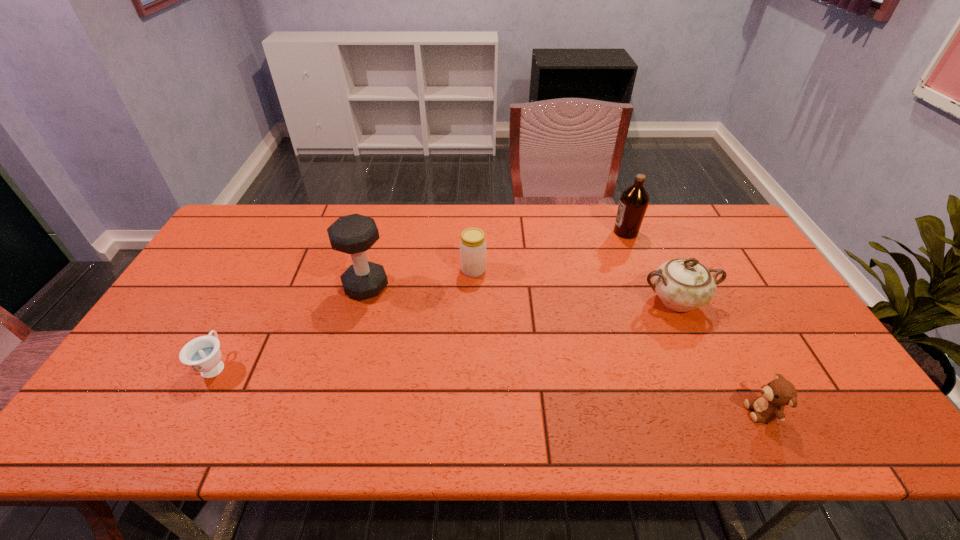
I want to click on free spot between the second object from left to right and the third tallest object, so click(x=521, y=294).

Find the location of `free space between the fourth shortest object and the olive oil`. free space between the fourth shortest object and the olive oil is located at coordinates (651, 266).

Where is `free space between the fourth shortest object and the fourth object from right to left`? free space between the fourth shortest object and the fourth object from right to left is located at coordinates (575, 286).

Locate an element on the screen. Image resolution: width=960 pixels, height=540 pixels. vacant area that lies between the fourth tallest object and the teddy bear is located at coordinates (617, 341).

You are a GUI agent. You are given a task and a screenshot of the screen. Output one action in this format:
    pyautogui.click(x=<x>, y=<y>)
    Task: Click on the free spot between the olive oil and the fifth object from right to left
    This screenshot has width=960, height=540.
    Given the screenshot: What is the action you would take?
    pyautogui.click(x=495, y=259)

Identify the location of free space between the farthest object and the dumbbell. [495, 259].

Identify the location of free space between the second shortest object and the shortest object. This screenshot has width=960, height=540. (489, 389).

You are a GUI agent. You are given a task and a screenshot of the screen. Output one action in this format:
    pyautogui.click(x=<x>, y=<y>)
    Task: Click on the vacant area between the teacup and the olive oil
    The image size is (960, 540).
    Given the screenshot: What is the action you would take?
    pyautogui.click(x=420, y=299)

The image size is (960, 540). Find the location of `object identified as the fourth closest to the olive oil`. object identified as the fourth closest to the olive oil is located at coordinates (354, 234).

Where is `the fifth closest object relative to the farthest object`? The width and height of the screenshot is (960, 540). the fifth closest object relative to the farthest object is located at coordinates (202, 354).